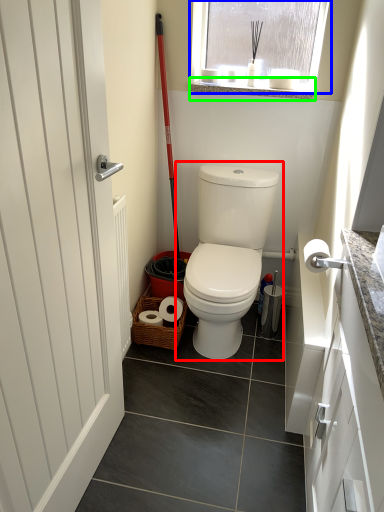
Question: Which object is positioned closest to toilet (highlighted by a red box)? Select from window (highlighted by a blue box) and window sill (highlighted by a green box).

Choices:
 (A) window
 (B) window sill

Answer: (A)